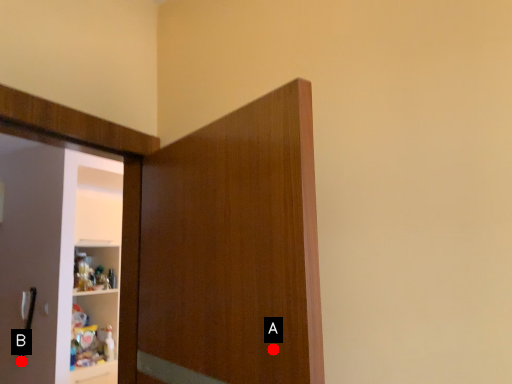
Question: Two points are circled on the image, labeled by A and B beside each circle. Which point appears farthest from the camera in this image?

Choices:
 (A) A is further
 (B) B is further

Answer: (B)